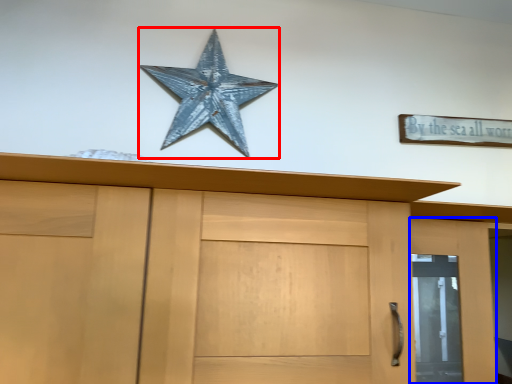
Question: Which of the following is the farthest to the observer, starfish (highlighted by a red box) or door (highlighted by a blue box)?

Choices:
 (A) starfish
 (B) door

Answer: (A)